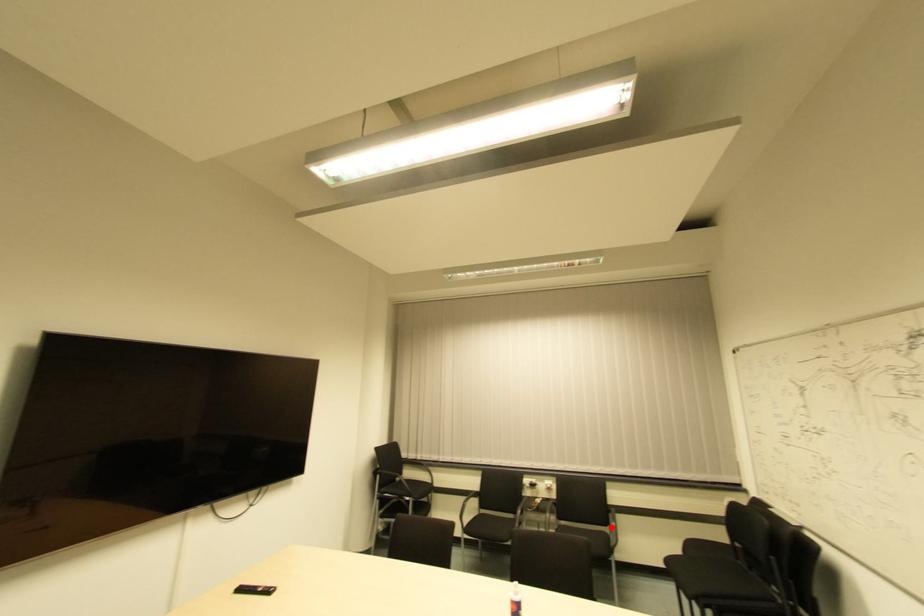
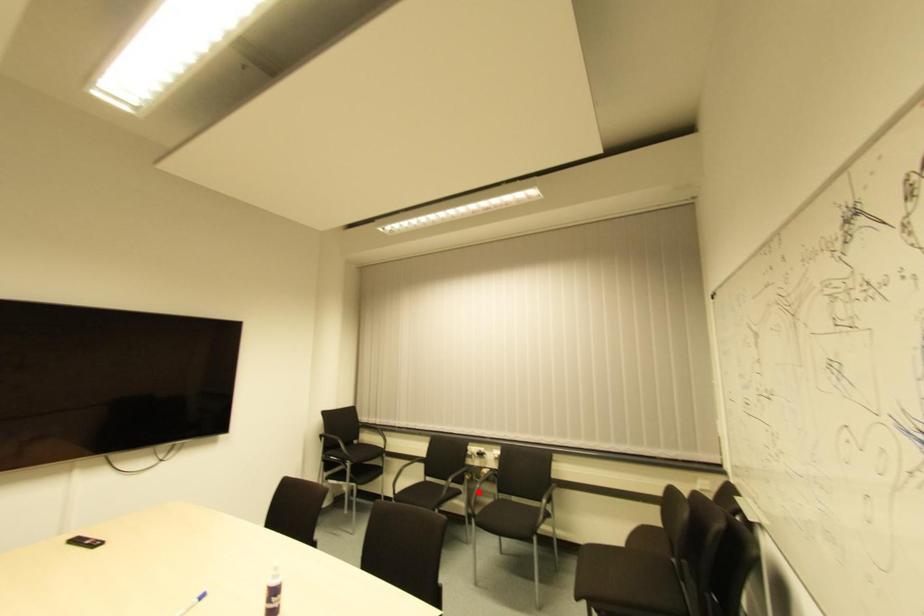
I am providing you with two images of the same scene from different viewpoints. A red point is marked on the first image and another point is marked on the second image. Is the red point in image1 aligned with the point shown in image2?

No